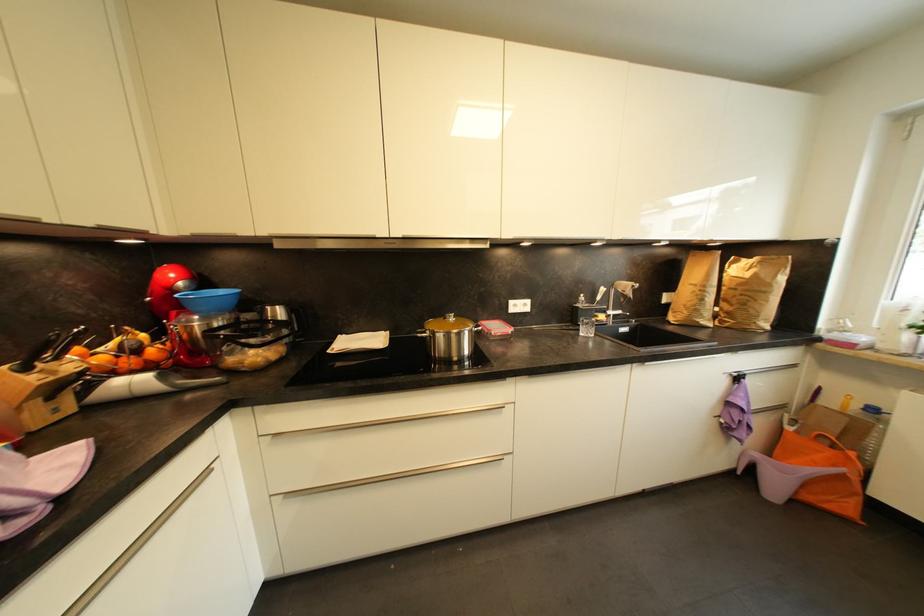
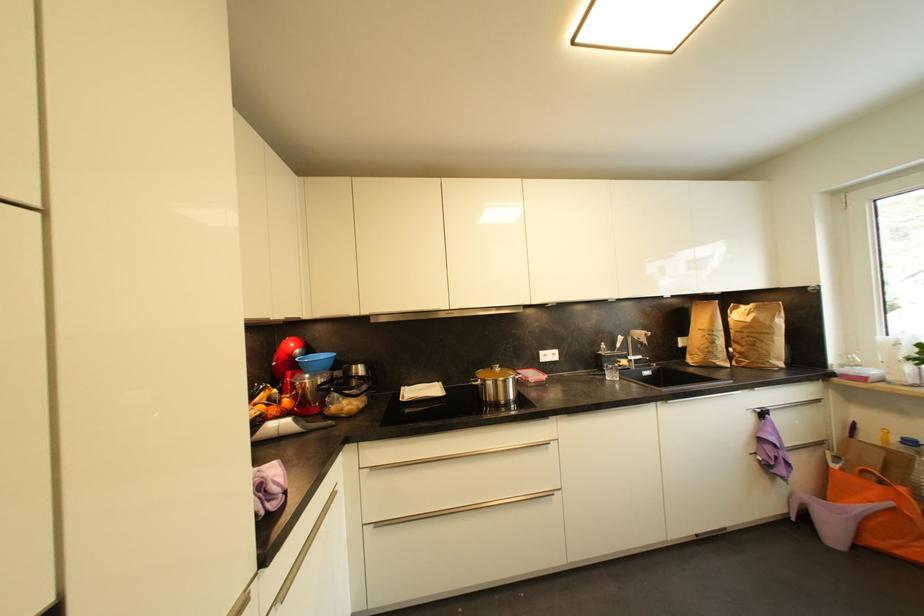
Where in the second image is the point corresponding to the point at 624,314 from the first image?

(645, 359)